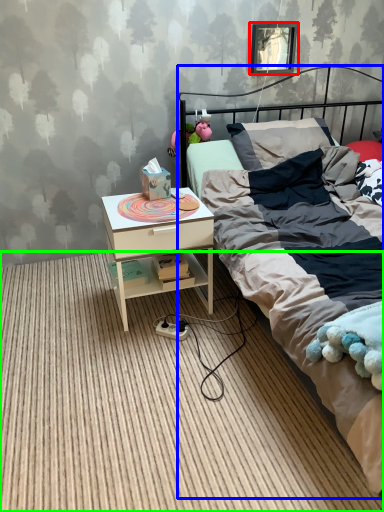
Question: Which object is the closest to the picture frame (highlighted by a red box)? Choose among these: bed (highlighted by a blue box) or plain (highlighted by a green box).

Choices:
 (A) bed
 (B) plain

Answer: (A)